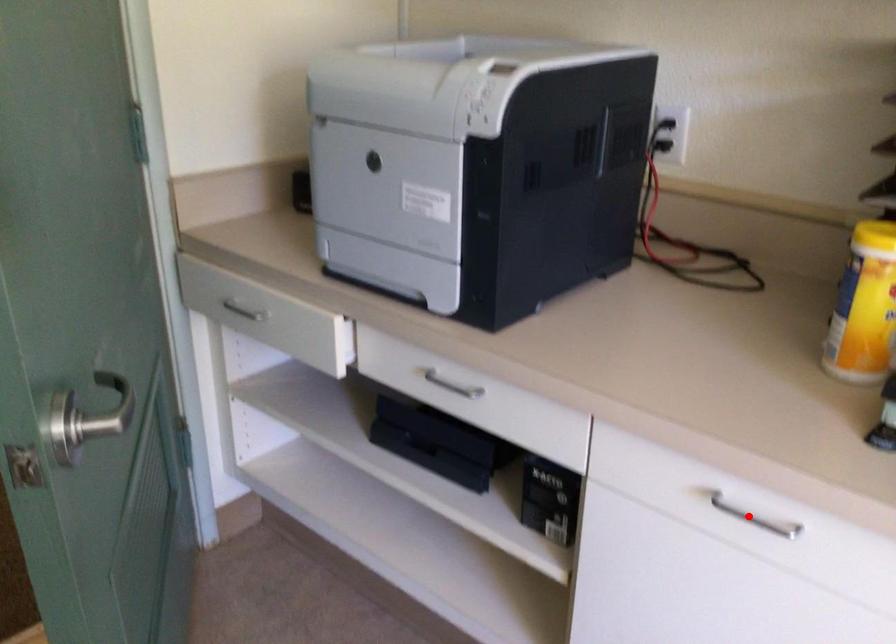
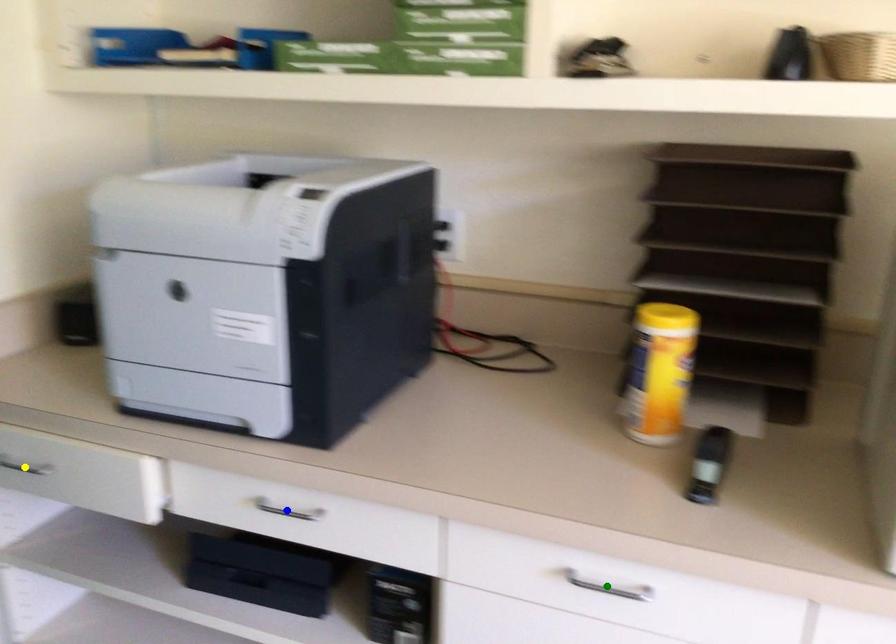
Question: I am providing you with two images of the same scene from different viewpoints. A red point is marked on the first image. You are given multiple points on the second image. Which point in image 2 represents the same 3d spot as the red point in image 1?

Choices:
 (A) yellow point
 (B) blue point
 (C) green point

Answer: (C)